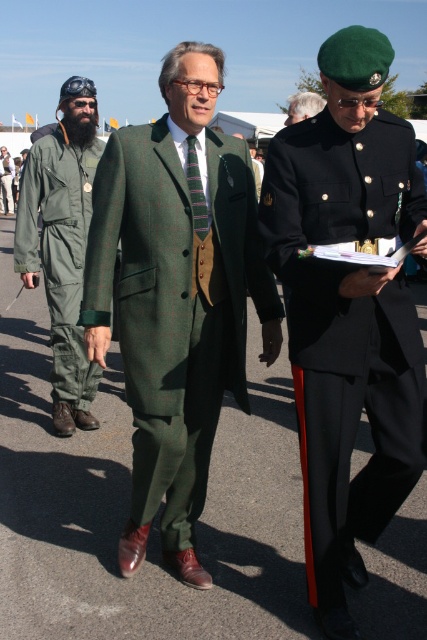
Is matte green jumpsuit at left positioned at the back of green military uniform at left?

No, matte green jumpsuit at left is in front of green military uniform at left.

Between matte green jumpsuit at left and green military uniform at left, which one is positioned higher?

green military uniform at left is above.

Where is `matte green jumpsuit at left`? matte green jumpsuit at left is located at coordinates 63,244.

Which is behind, point (327, 515) or point (88, 90)?

Point (88, 90)

Which of these two, green wool coat at center or matte green jumpsuit at left, stands shorter?

green wool coat at center is shorter.

Who is more forward, (322, 488) or (69, 192)?

Point (322, 488) is more forward.

Find the location of `green wool coat at center`. green wool coat at center is located at coordinates (348, 310).

Can you confirm if green wool coat at center is smaller than green wool suit at center?

Correct, green wool coat at center occupies less space than green wool suit at center.

Between point (298, 237) and point (251, 285), which one is positioned behind?

Positioned behind is point (251, 285).

Identify the location of green wool coat at center. The height and width of the screenshot is (640, 427). (348, 310).